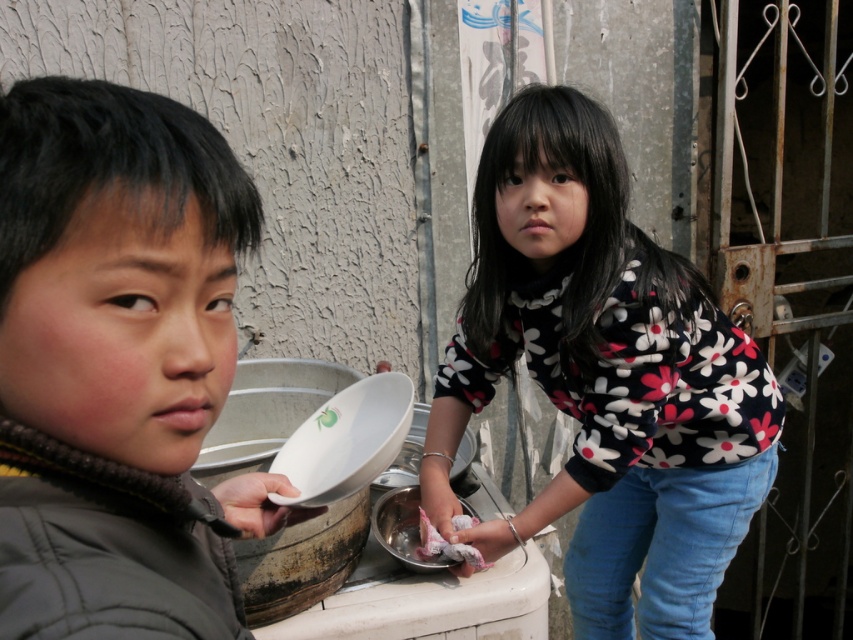
Is floral-patterned sweater at center to the left of white fluffy food at lower center from the viewer's perspective?

No, floral-patterned sweater at center is not to the left of white fluffy food at lower center.

Who is positioned more to the left, floral-patterned sweater at center or white fluffy food at lower center?

Positioned to the left is white fluffy food at lower center.

The height and width of the screenshot is (640, 853). What do you see at coordinates (604, 376) in the screenshot? I see `floral-patterned sweater at center` at bounding box center [604, 376].

Image resolution: width=853 pixels, height=640 pixels. I want to click on floral-patterned sweater at center, so click(x=604, y=376).

What do you see at coordinates (604, 376) in the screenshot? I see `floral-patterned sweater at center` at bounding box center [604, 376].

Which is in front, point (566, 342) or point (204, 262)?

Point (204, 262) is in front.

Does point (453, 451) come behind point (38, 353)?

Yes, point (453, 451) is farther from viewer.

The height and width of the screenshot is (640, 853). I want to click on floral-patterned sweater at center, so click(604, 376).

Is point (378, 412) behind point (468, 552)?

No, it is not.

Is point (404, 388) farther from camera compared to point (416, 550)?

No, it is not.

Locate an element on the screen. white glossy plate at center is located at coordinates (346, 440).